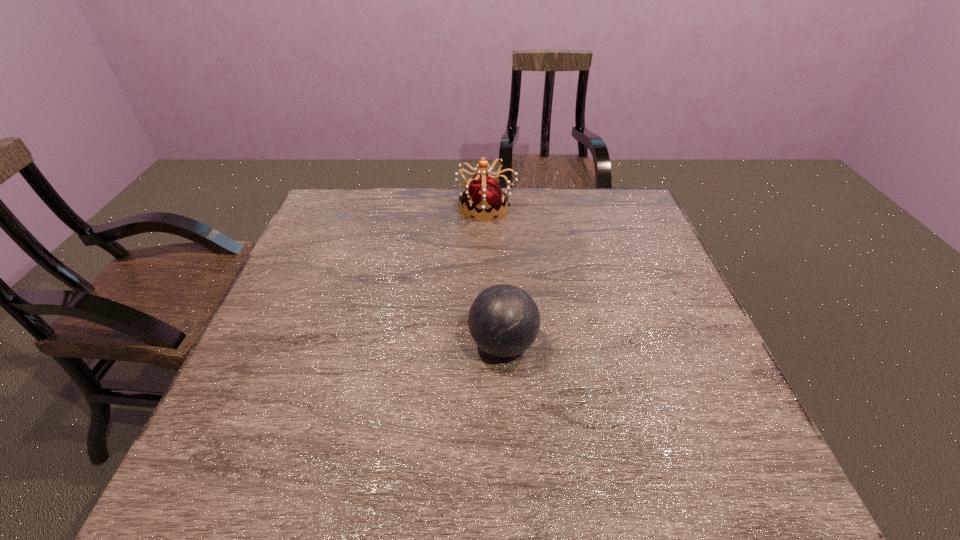
Locate an element on the screen. object that is at the far edge is located at coordinates (483, 196).

Image resolution: width=960 pixels, height=540 pixels. In the image, there is a desktop. In order to click on vacant region at the far edge in this screenshot , I will do `click(532, 220)`.

This screenshot has height=540, width=960. Find the location of `free space at the near edge of the desktop`. free space at the near edge of the desktop is located at coordinates (368, 453).

Find the location of a particular element. This screenshot has height=540, width=960. free region at the left edge of the desktop is located at coordinates (293, 261).

This screenshot has width=960, height=540. Find the location of `vacant space at the right edge of the desktop`. vacant space at the right edge of the desktop is located at coordinates (662, 370).

Image resolution: width=960 pixels, height=540 pixels. In the image, there is a desktop. Find the location of `vacant space at the far left corner`. vacant space at the far left corner is located at coordinates (328, 204).